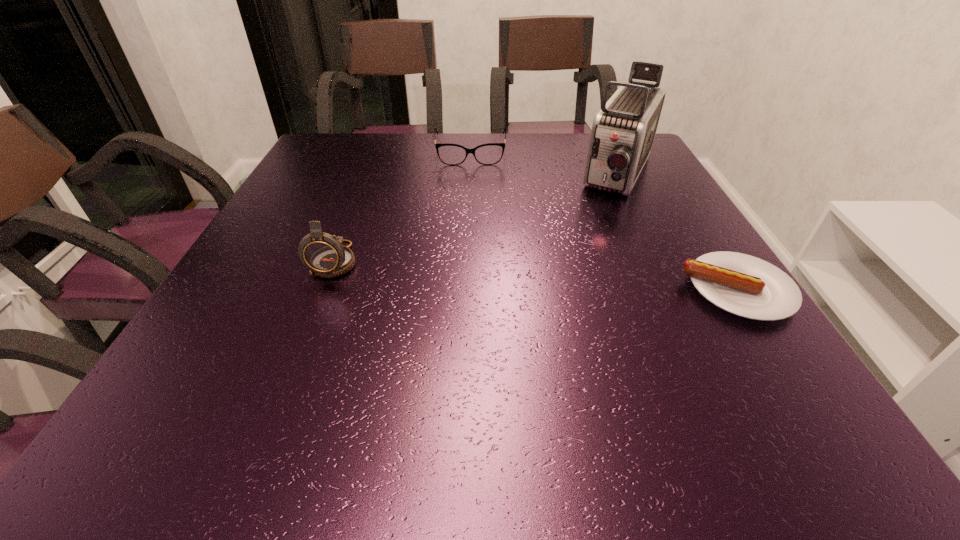
Image resolution: width=960 pixels, height=540 pixels. I want to click on the second tallest object, so tap(324, 254).

Find the location of a particular element. Image resolution: width=960 pixels, height=540 pixels. the leftmost object is located at coordinates (324, 254).

Identify the location of the shortest object. This screenshot has width=960, height=540. (747, 286).

The width and height of the screenshot is (960, 540). What are the coordinates of `the third tallest object` in the screenshot? It's located at (450, 154).

Image resolution: width=960 pixels, height=540 pixels. In order to click on the second object from left to right in this screenshot , I will do `click(450, 154)`.

This screenshot has width=960, height=540. What are the coordinates of `the tallest object` in the screenshot? It's located at (623, 131).

This screenshot has width=960, height=540. In order to click on free space located 0.050m on the face of the compass in this screenshot , I will do `click(320, 302)`.

You are a GUI agent. You are given a task and a screenshot of the screen. Output one action in this format:
    pyautogui.click(x=<x>, y=<y>)
    Task: Click on the free space located on the back of the sausage
    The image size is (960, 540).
    Given the screenshot: What is the action you would take?
    pyautogui.click(x=667, y=181)

Where is `free point located on the front-facing side of the third object from right to left`? This screenshot has width=960, height=540. free point located on the front-facing side of the third object from right to left is located at coordinates (470, 253).

I want to click on free region located 0.230m on the front-facing side of the third object from right to left, so click(x=470, y=211).